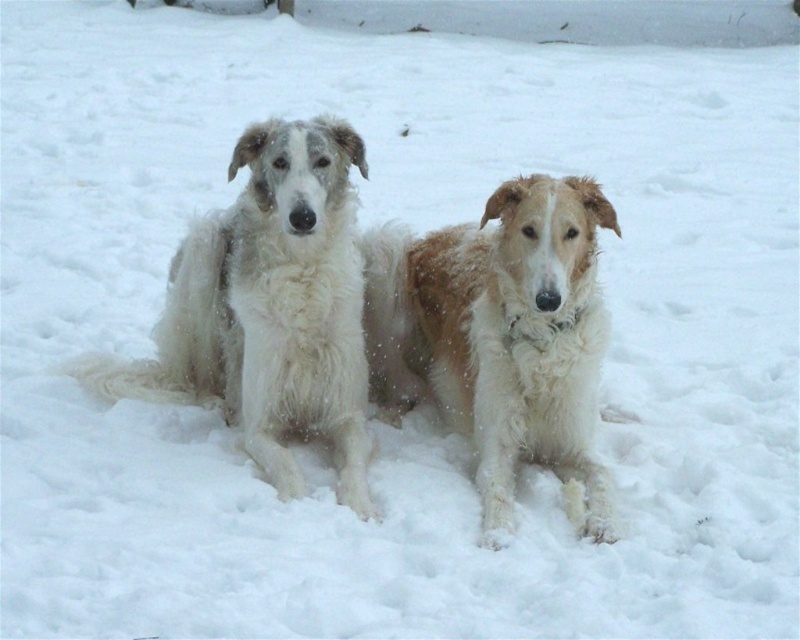
Which of these two, fuzzy white dog at center or white fluffy dog at left, stands taller?

white fluffy dog at left is taller.

Does fuzzy white dog at center appear on the left side of white fluffy dog at left?

No, fuzzy white dog at center is not to the left of white fluffy dog at left.

Which is in front, point (548, 353) or point (232, 328)?

Positioned in front is point (548, 353).

I want to click on fuzzy white dog at center, so click(x=501, y=337).